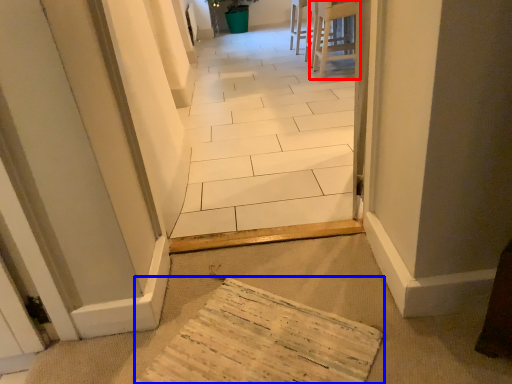
Question: Which object is closer to the camera taking this photo, furniture (highlighted by a red box) or cardboard (highlighted by a blue box)?

Choices:
 (A) furniture
 (B) cardboard

Answer: (B)